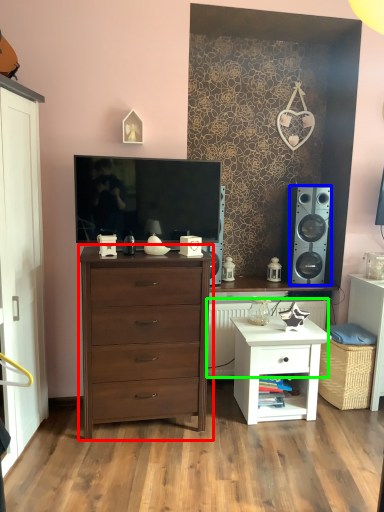
Question: Which object is positioned closest to chest of drawers (highlighted by a red box)? Select from speaker (highlighted by a blue box) and radiator (highlighted by a green box).

Choices:
 (A) speaker
 (B) radiator

Answer: (B)